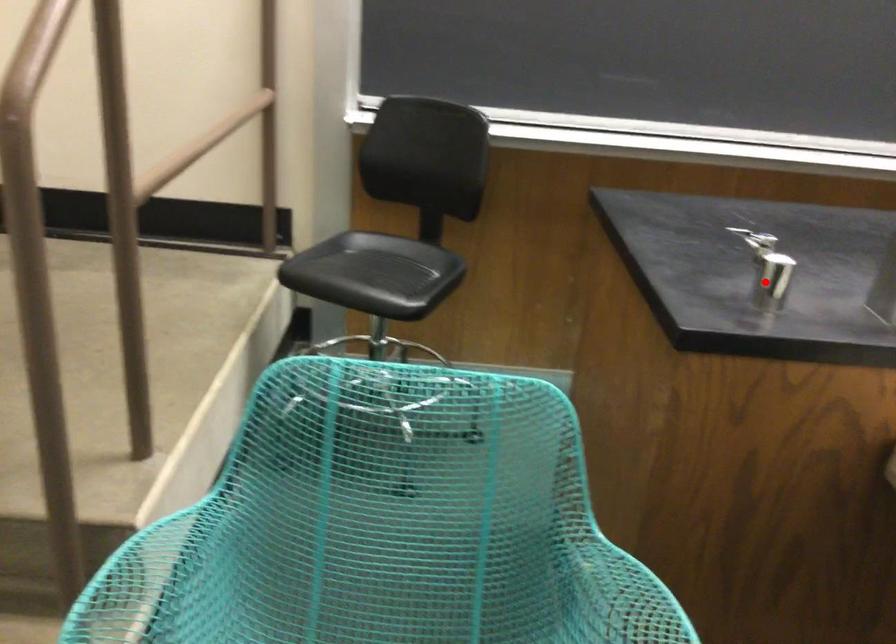
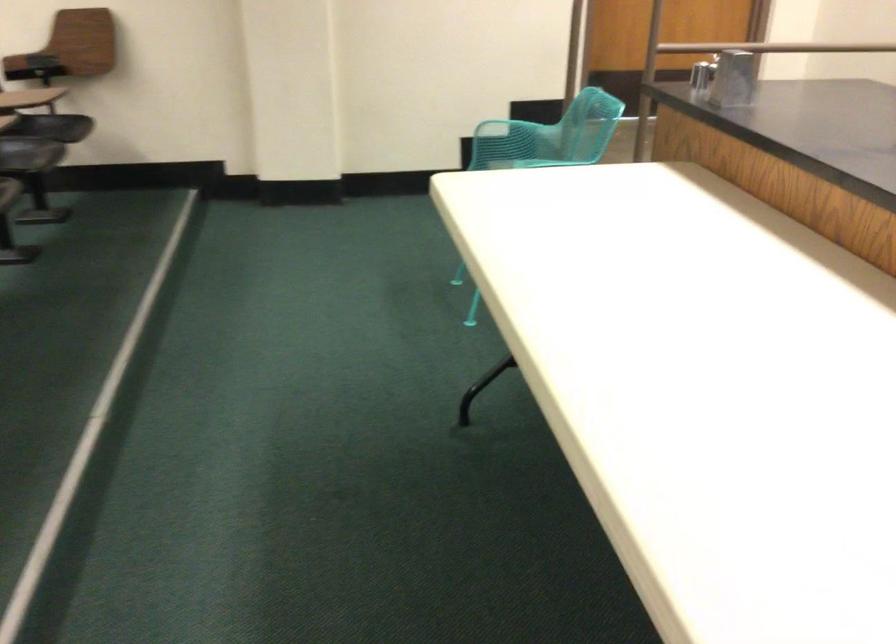
In the second image, find the point that corresponds to the highlighted location in the first image.

(702, 75)